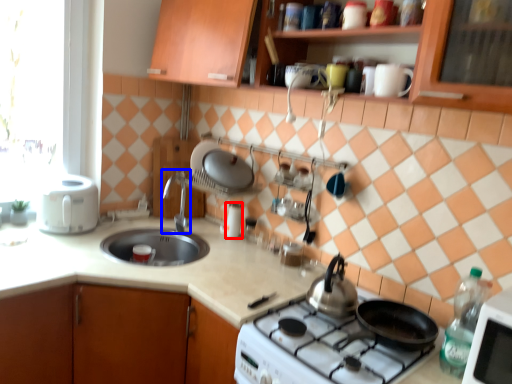
Question: Which object is closer to the camera taking this photo, appliance (highlighted by a red box) or faucet (highlighted by a blue box)?

Choices:
 (A) appliance
 (B) faucet

Answer: (B)